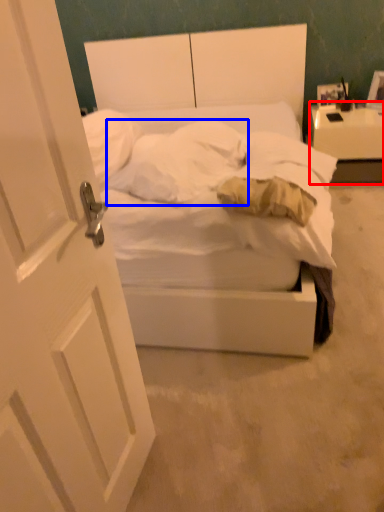
Question: Which object appears closest to the camera in this image, nightstand (highlighted by a red box) or pillow (highlighted by a blue box)?

Choices:
 (A) nightstand
 (B) pillow

Answer: (B)